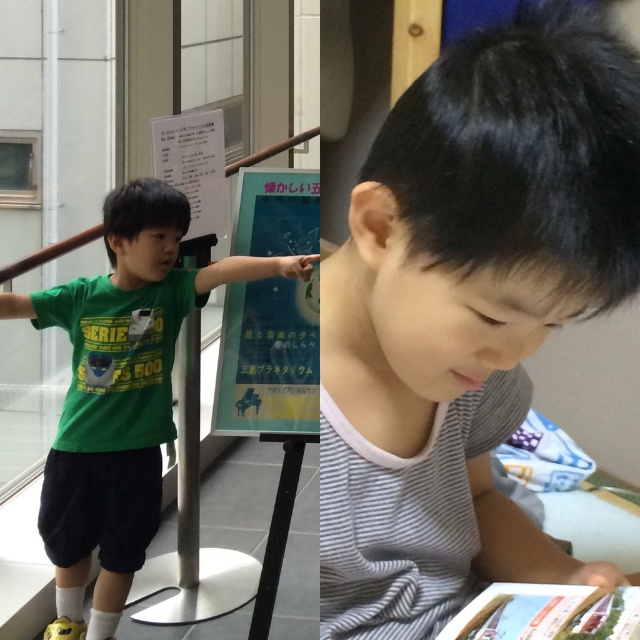
You are a photographer standing in front of the blue paper poster at center and the green matte shirt at center. You want to take a photo of both objects in focus. Which one should you focus on first to ensure both are sharp?

You should focus on the green matte shirt at center first since it is closer to the viewer than the blue paper poster at center, allowing both to be in focus when using depth of field properly.

You are a robot assistant standing at the center of the scene. You need to hand a document to the person wearing the gray striped shirt at center without moving closer than 5 feet to the blue paper poster at center. Is this possible?

The distance between the gray striped shirt at center and the blue paper poster at center is 4.99 feet. Since the required minimum distance to the poster is 5 feet, the robot cannot hand the document while maintaining the required distance.